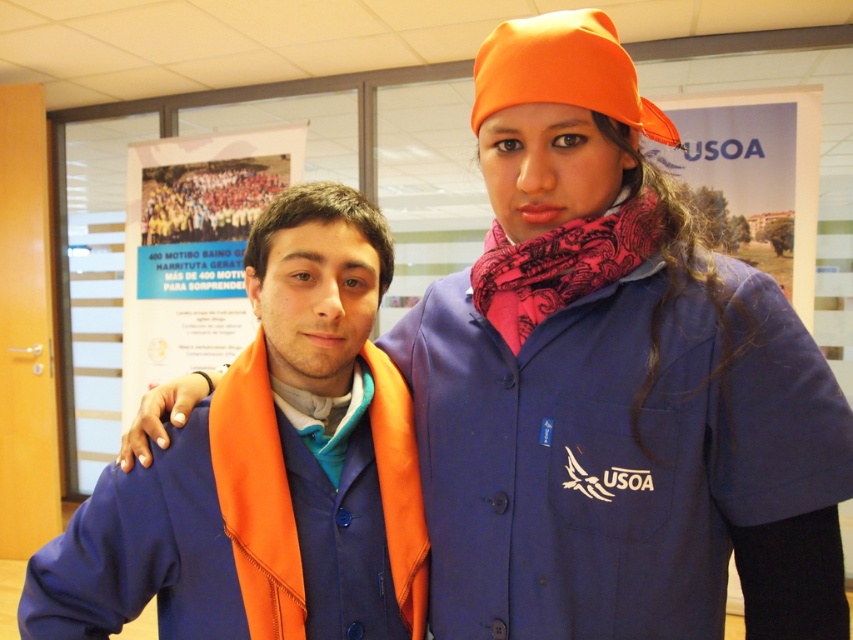
You are standing at the point marked as point (381, 355) in the image. You want to hand a document to the person on the right, who is wearing a navy blue jacket with the USOA logo. Can you reach them without moving from your current position? Please explain your reasoning based on the distance between you and the person.

The distance between you and the person on the right is 3.53 feet. Since this distance is within a typical arm reach, you can likely hand the document to them without moving from your current position.

You are attending an event and need to locate two orange items in the image. The first is the orange fabric hat at upper center, and the second is the orange fabric at center. Which of these two orange items is positioned to the right of the other?

The orange fabric hat at upper center is to the right of the orange fabric at center.